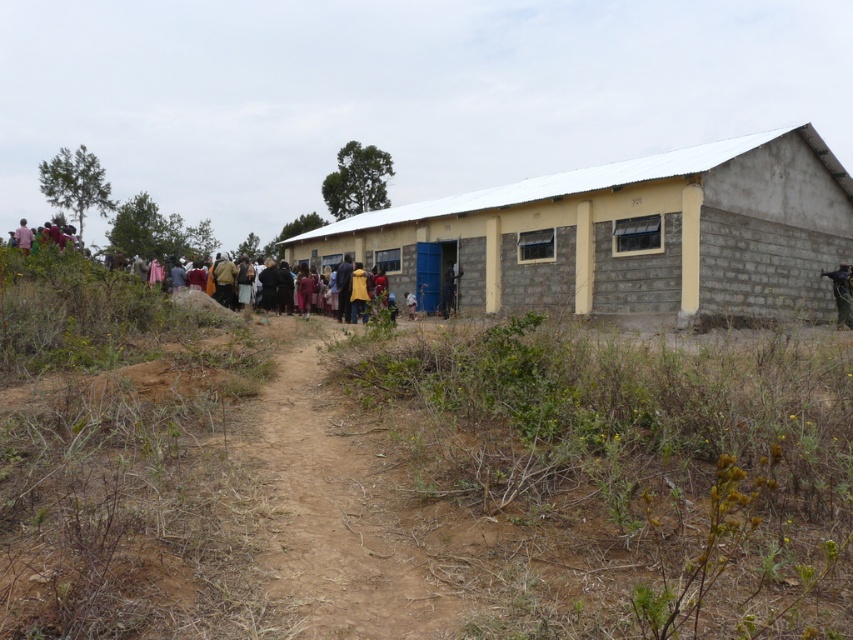
You are a delivery driver approaching the brown dirt track at center leading to the yellow building. You notice the brown dirt field at center nearby. Which direction should you turn to stay on the path towards the building?

The brown dirt track at center is below the brown dirt field at center, so you should turn downward to stay on the path towards the building.

You are standing at the point labeled as point (625,234) in the image. What structure is directly in front of you?

The point (625,234) indicates the gray concrete building at center, so the structure directly in front of you is the gray concrete building at center.

You are a delivery person trying to park your truck on the brown dirt field at center. However, you notice the brown dirt track at center nearby. Which location is higher in elevation between the two? Please choose the higher one to avoid waterlogging during rain.

The brown dirt field at center has a greater height compared to the brown dirt track at center, so you should park on the brown dirt field at center to avoid waterlogging during rain.